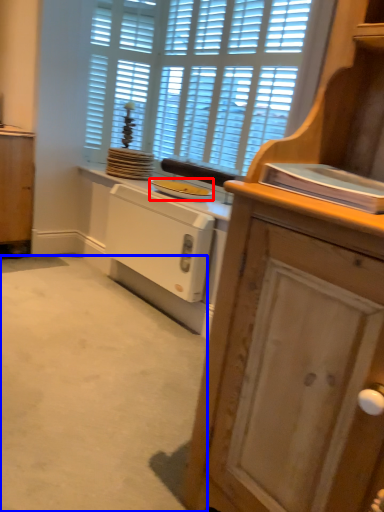
Question: Which point is closer to the camera, appliance (highlighted by a red box) or plain (highlighted by a blue box)?

Choices:
 (A) appliance
 (B) plain

Answer: (B)